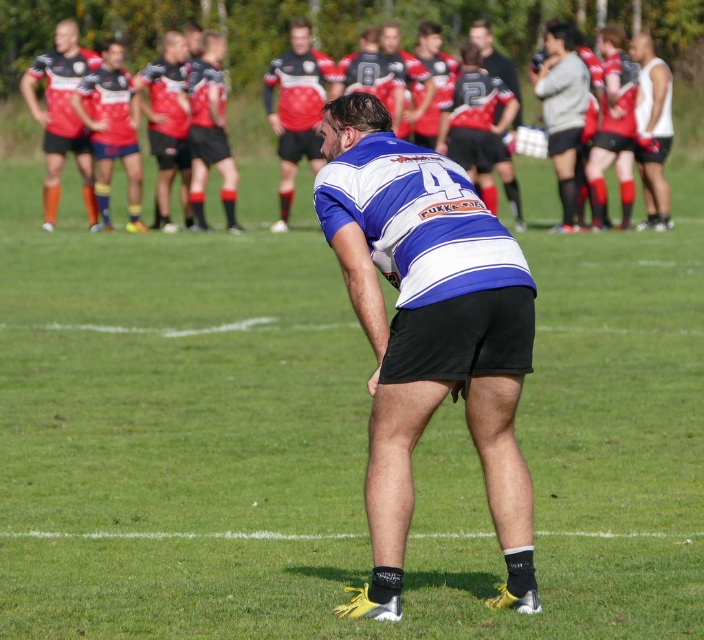
Who is lower down, matte red and black rugby jersey at upper center or gray matte sweater at upper right?

matte red and black rugby jersey at upper center is lower down.

Can you confirm if matte red and black rugby jersey at upper center is positioned to the right of gray matte sweater at upper right?

Incorrect, matte red and black rugby jersey at upper center is not on the right side of gray matte sweater at upper right.

The image size is (704, 640). I want to click on matte red and black rugby jersey at upper center, so click(296, 108).

At what (x,y) coordinates should I click in order to perform the action: click on matte red and black rugby jersey at upper center. Please return your answer as a coordinate pair (x, y). Looking at the image, I should click on (296, 108).

Does point (501, 234) come in front of point (650, 221)?

Yes.

Is point (458, 300) closer to viewer compared to point (670, 74)?

Yes, it is.

You are a GUI agent. You are given a task and a screenshot of the screen. Output one action in this format:
    pyautogui.click(x=<x>, y=<y>)
    Task: Click on the blue striped jersey at center
    
    Given the screenshot: What is the action you would take?
    pyautogui.click(x=427, y=330)

Is blue striped jersey at center positioned at the back of matte red and black rugby jersey at upper center?

No.

Is point (337, 225) closer to viewer compared to point (308, 152)?

Yes, it is in front of point (308, 152).

In order to click on blue striped jersey at center in this screenshot , I will do `click(427, 330)`.